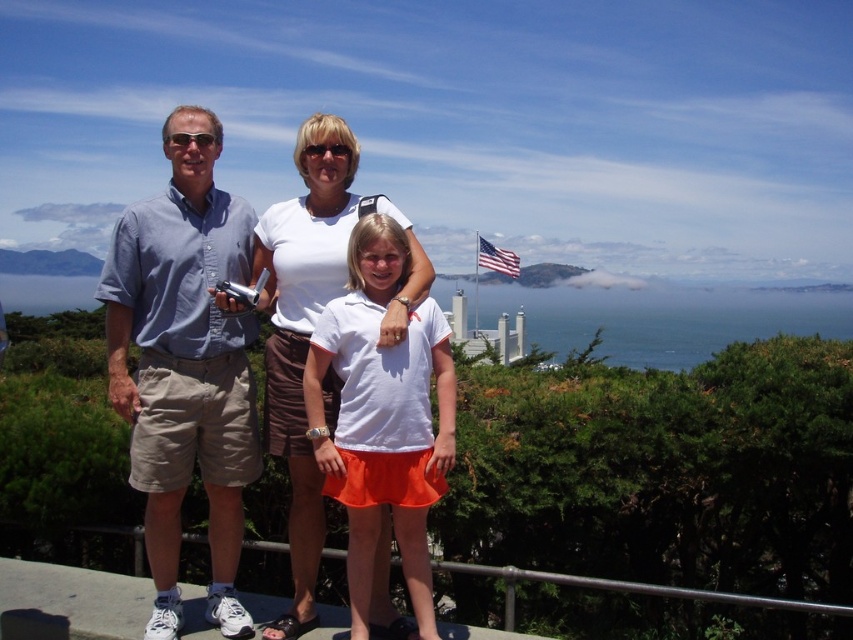
Question: Does white cotton shirt at center appear over american flag at center?

Choices:
 (A) yes
 (B) no

Answer: (B)

Question: Which point appears farthest from the camera in this image?

Choices:
 (A) (480, 259)
 (B) (177, 410)

Answer: (A)

Question: Does light blue shirt at center have a smaller size compared to white cotton shirt at center?

Choices:
 (A) no
 (B) yes

Answer: (A)

Question: Which object is positioned closest to the light blue shirt at center?

Choices:
 (A) white cotton shirt at center
 (B) white matte shirt at center

Answer: (A)

Question: Can you confirm if light blue shirt at center is bigger than white matte shirt at center?

Choices:
 (A) no
 (B) yes

Answer: (B)

Question: Which point is farther to the camera?

Choices:
 (A) white matte shirt at center
 (B) white cotton shirt at center

Answer: (B)